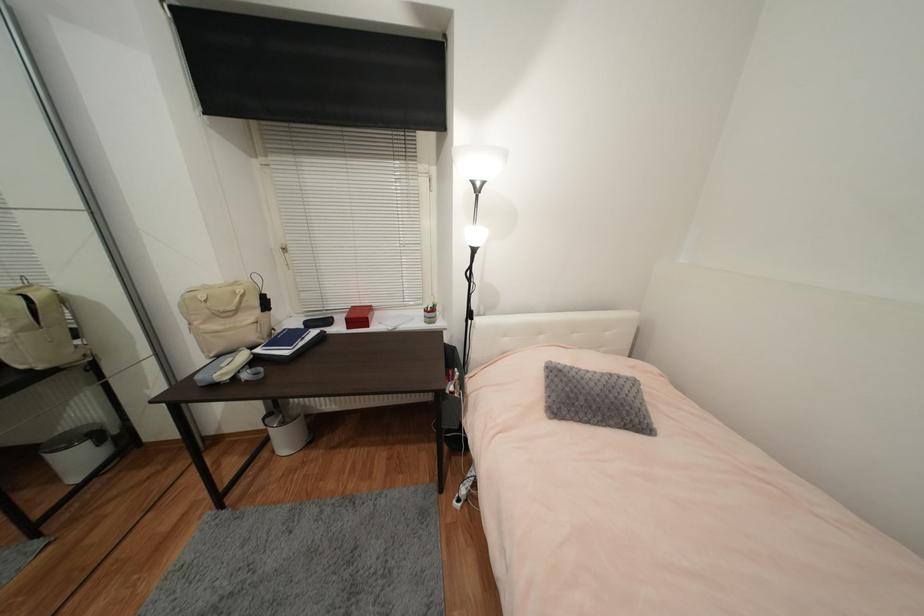
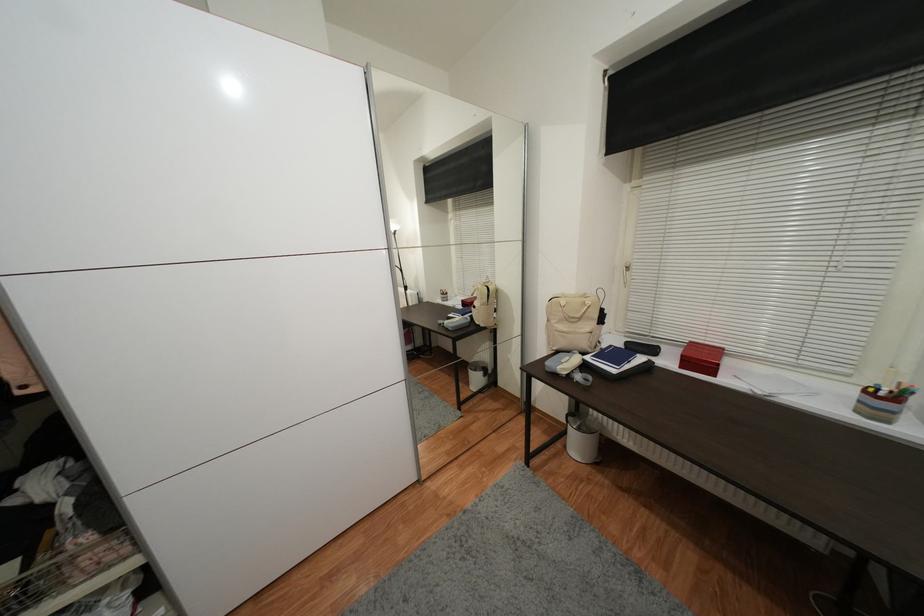
The point at [430,312] is marked in the first image. Where is the corresponding point in the second image?

(871, 392)